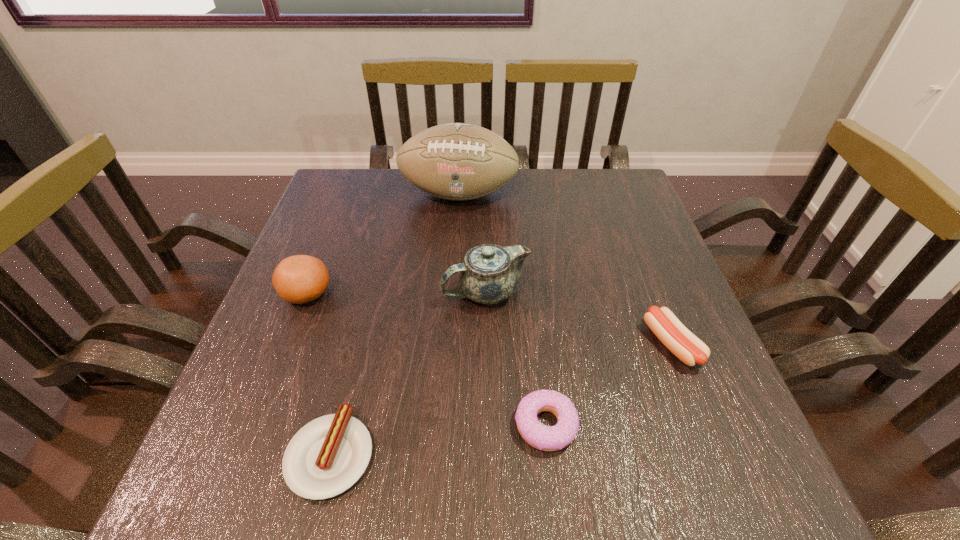
I want to click on free space between the clementine and the farthest object, so click(x=383, y=244).

Choose which object is the fourth nearest neighbor to the chinaware. Please provide its 2D coordinates. Your answer should be formatted as a tuple, i.e. [(x, y)], where the tuple contains the x and y coordinates of a point satisfying the conditions above.

[(298, 279)]

Locate an element on the screen. object that stands as the closest to the fifth shortest object is located at coordinates (546, 438).

Image resolution: width=960 pixels, height=540 pixels. I want to click on free spot that satisfies the following two spatial constraints: 1. from the spout of the second tallest object; 2. on the left side of the doughnut, so click(487, 424).

I want to click on vacant space that satisfies the following two spatial constraints: 1. from the spout of the fifth shortest object; 2. on the right side of the doughnut, so click(487, 424).

You are a GUI agent. You are given a task and a screenshot of the screen. Output one action in this format:
    pyautogui.click(x=<x>, y=<y>)
    Task: Click on the vacant space that satisfies the following two spatial constraints: 1. from the spout of the fifth shortest object; 2. on the left side of the doughnut
    The width and height of the screenshot is (960, 540).
    Given the screenshot: What is the action you would take?
    pyautogui.click(x=487, y=424)

This screenshot has height=540, width=960. I want to click on vacant area that satisfies the following two spatial constraints: 1. from the spout of the fifth shortest object; 2. on the front side of the third tallest object, so click(x=485, y=294).

The image size is (960, 540). I want to click on vacant point that satisfies the following two spatial constraints: 1. from the spout of the doughnut; 2. on the left side of the chinaware, so click(487, 424).